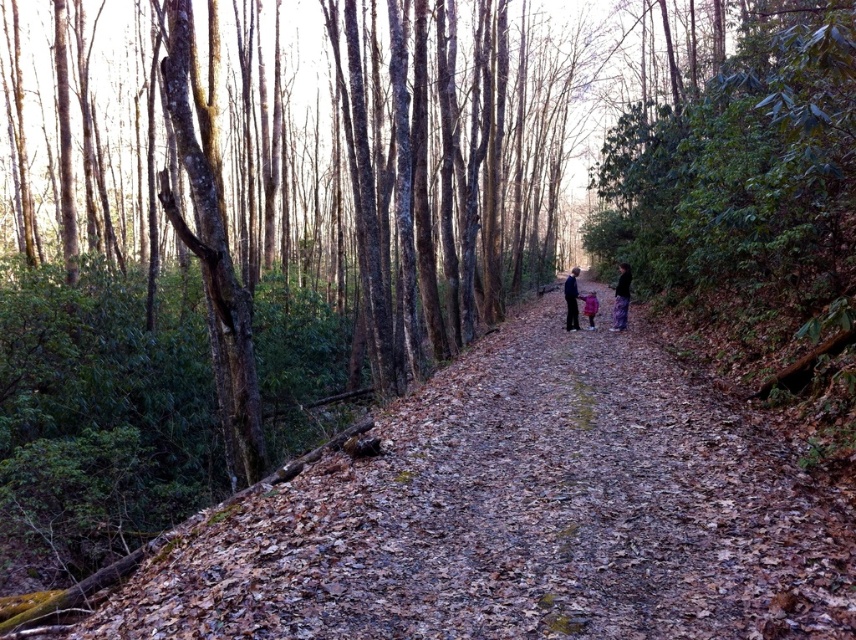
You are a hiker who wants to know which jacket is taller between the dark blue jacket at center and the pink fleece jacket at center. Can you help me determine which one is taller?

The dark blue jacket at center is much taller than the pink fleece jacket at center.

You are a hiker walking along the brown leafy forest path at center and carrying the pink fleece jacket at center. If you look ahead, which object will you see closer to you?

The brown leafy forest path at center is in front of the pink fleece jacket at center, so you will see the brown leafy forest path at center closer to you.

You are standing on a forest path and want to walk towards the two points marked in the scene. Which point, point (137, 579) or point (575, 298), is closer to you?

Point (137, 579) is closer to the viewer than point (575, 298).